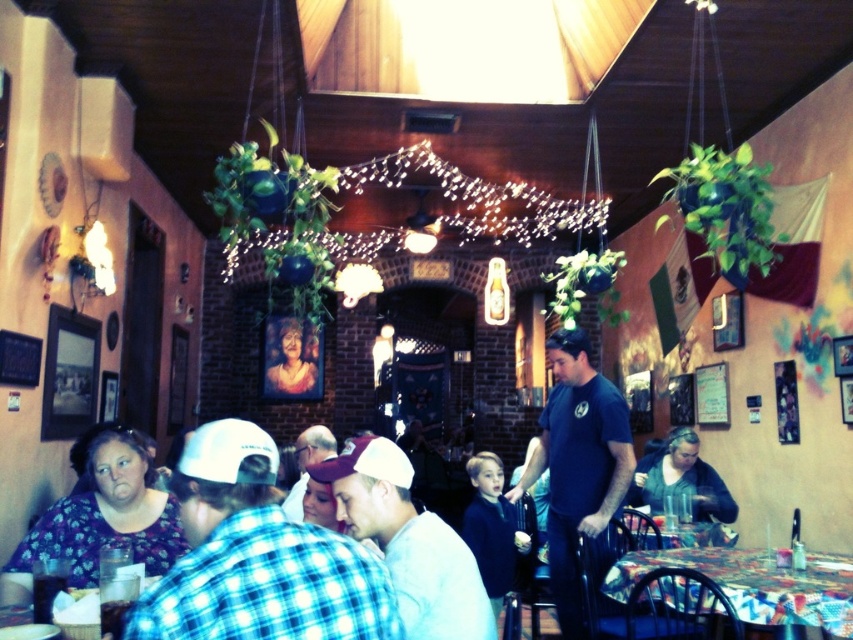
Question: Can you confirm if dark blue sweater at center is positioned below dark green sweater at lower right?

Choices:
 (A) yes
 (B) no

Answer: (A)

Question: Which point is farther to the camera?

Choices:
 (A) dark blue sweater at center
 (B) floral-patterned blouse at lower left
 (C) dark blue t-shirt at center
 (D) checkered fabric shirt at center

Answer: (A)

Question: Does checkered fabric shirt at center appear under floral-patterned blouse at lower left?

Choices:
 (A) yes
 (B) no

Answer: (B)

Question: Which object is the farthest from the dark blue t-shirt at center?

Choices:
 (A) matte pink hair at center
 (B) white matte cap at center
 (C) checkered fabric shirt at center
 (D) dark green sweater at lower right

Answer: (A)

Question: Which point is farther to the camera?

Choices:
 (A) floral-patterned blouse at lower left
 (B) dark green sweater at lower right
 (C) white matte cap at center
 (D) dark blue t-shirt at center

Answer: (B)

Question: Does white matte cap at center have a greater width compared to floral-patterned blouse at lower left?

Choices:
 (A) yes
 (B) no

Answer: (A)